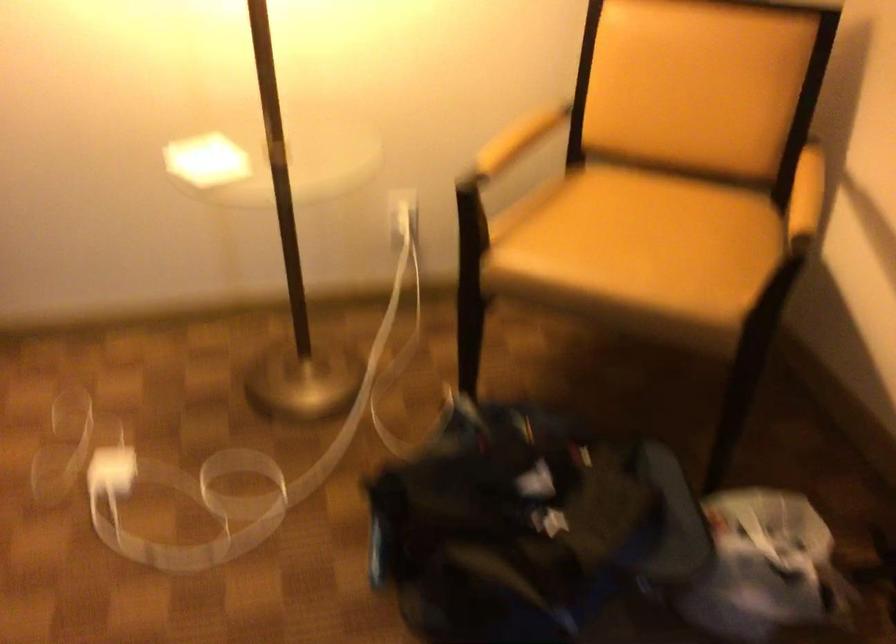
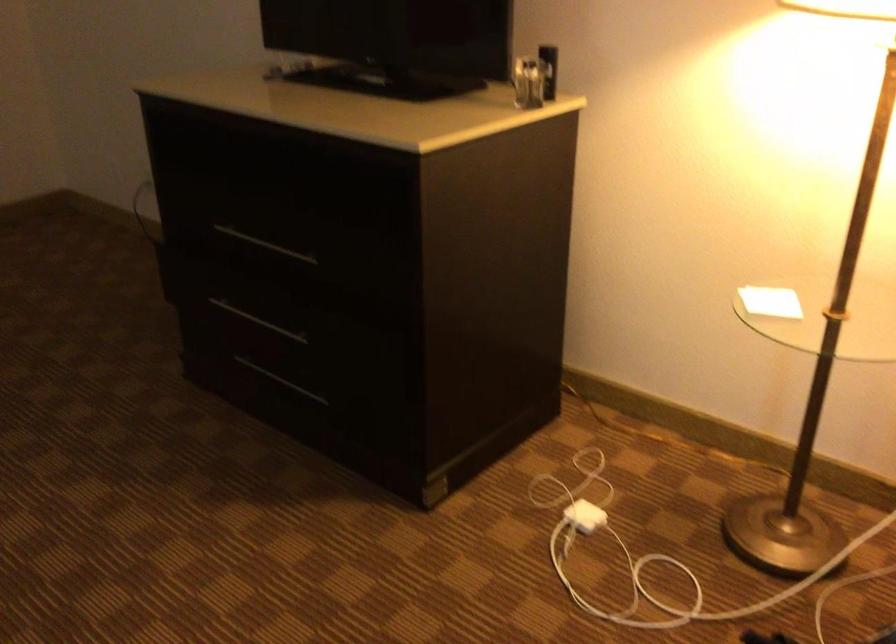
Question: The images are taken continuously from a first-person perspective. In which direction is your viewpoint rotating?

Choices:
 (A) Left
 (B) Right
 (C) Up
 (D) Down

Answer: (A)